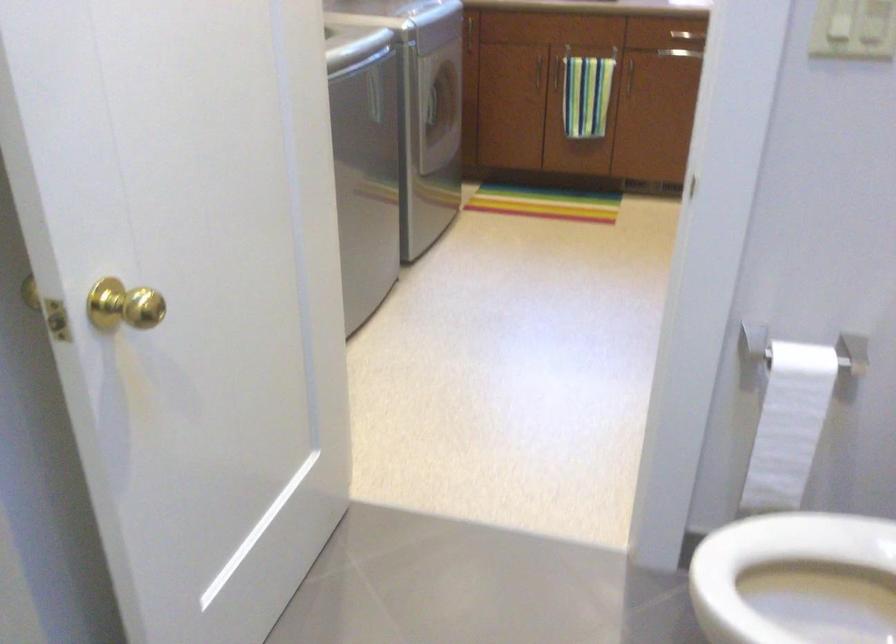
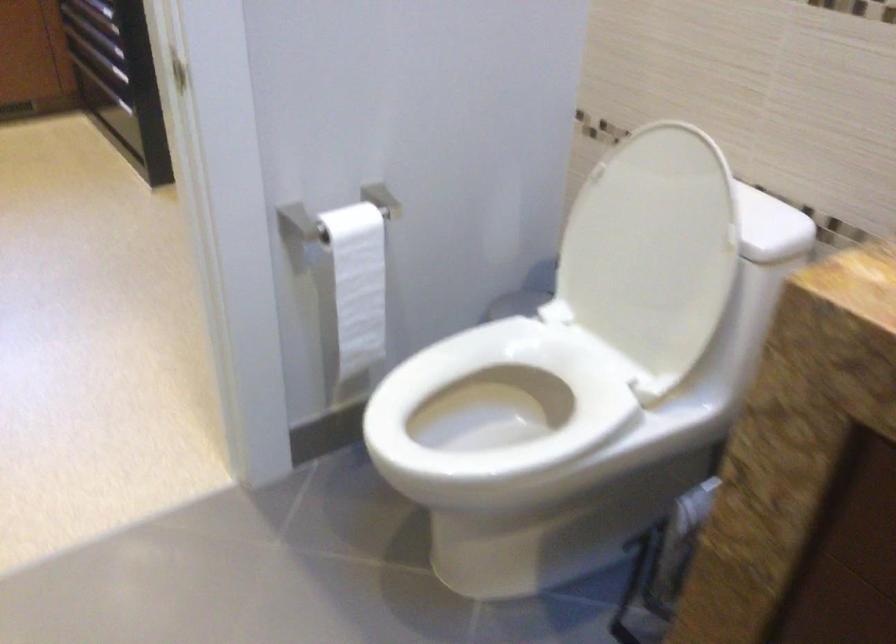
In the second image, find the point that corresponds to (789,428) in the first image.

(357, 283)